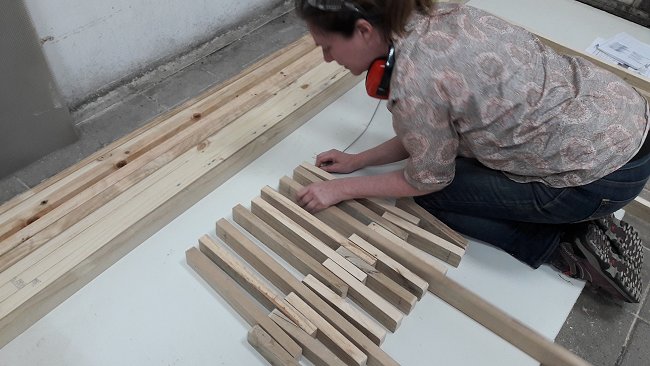
What are the coordinates of `cable` in the screenshot? It's located at (367, 131).